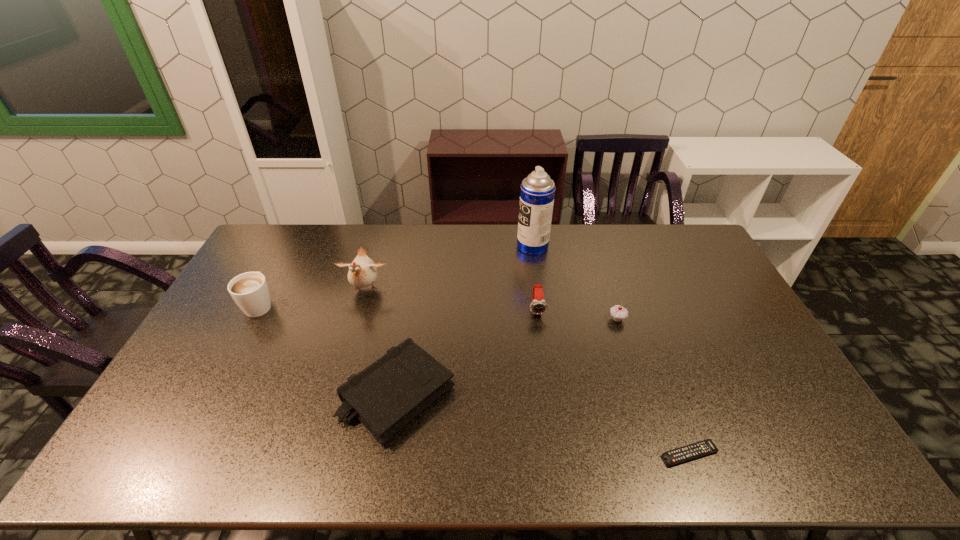
Find the location of a particular element. This screenshot has height=540, width=960. object that is at the far edge is located at coordinates (537, 192).

Where is `Bible situated at the near edge`? This screenshot has height=540, width=960. Bible situated at the near edge is located at coordinates (385, 396).

Identify the location of remote control that is at the near edge. This screenshot has width=960, height=540. (705, 447).

This screenshot has width=960, height=540. Identify the location of object that is at the left edge. (250, 291).

Identify the location of vacant space at the far edge of the desktop. (403, 247).

Locate an element on the screen. free space at the near edge of the desktop is located at coordinates (300, 448).

In the image, there is a desktop. At what (x,y) coordinates should I click in order to perform the action: click on vacant space at the left edge. Please return your answer as a coordinate pair (x, y). The width and height of the screenshot is (960, 540). Looking at the image, I should click on (281, 278).

At what (x,y) coordinates should I click in order to perform the action: click on free location at the right edge. Please return your answer as a coordinate pair (x, y). Looking at the image, I should click on (682, 275).

Where is `vacant space at the far left corner of the desktop`? This screenshot has width=960, height=540. vacant space at the far left corner of the desktop is located at coordinates (270, 253).

Image resolution: width=960 pixels, height=540 pixels. In order to click on vacant space at the near left corner in this screenshot , I will do `click(176, 439)`.